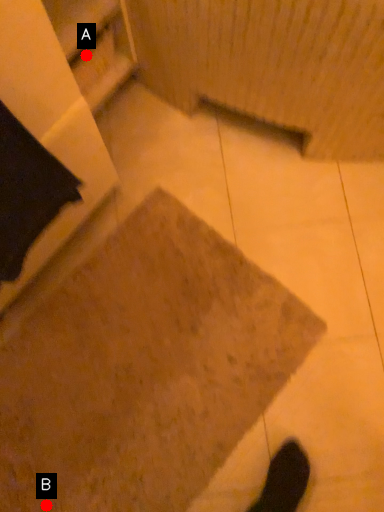
Question: Two points are circled on the image, labeled by A and B beside each circle. Which point is closer to the camera?

Choices:
 (A) A is closer
 (B) B is closer

Answer: (B)